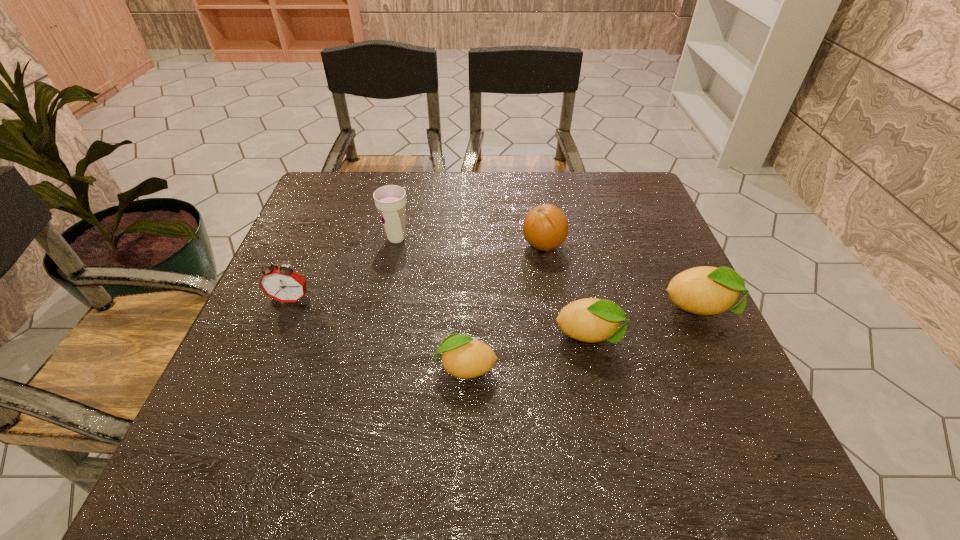
Image resolution: width=960 pixels, height=540 pixels. I want to click on the shortest object, so click(x=463, y=357).

You are a GUI agent. You are given a task and a screenshot of the screen. Output one action in this format:
    pyautogui.click(x=<x>, y=<y>)
    Task: Click on the shortest lemon
    
    Given the screenshot: What is the action you would take?
    pyautogui.click(x=463, y=357)

At what (x,y) coordinates should I click in order to perform the action: click on the second shortest lemon. Please return your answer as a coordinate pair (x, y). Looking at the image, I should click on (591, 320).

This screenshot has width=960, height=540. Find the location of `the rightmost object`. the rightmost object is located at coordinates (705, 290).

You are a GUI agent. You are given a task and a screenshot of the screen. Output one action in this format:
    pyautogui.click(x=<x>, y=<y>)
    Task: Click on the fifth object from right to left
    The width and height of the screenshot is (960, 540).
    Given the screenshot: What is the action you would take?
    pyautogui.click(x=390, y=200)

You are a GUI agent. You are given a task and a screenshot of the screen. Output one action in this format:
    pyautogui.click(x=<x>, y=<y>)
    Task: Click on the orange
    The width and height of the screenshot is (960, 540).
    Given the screenshot: What is the action you would take?
    point(545,227)

You are a GUI agent. You are given a task and a screenshot of the screen. Output one action in this format:
    pyautogui.click(x=<x>, y=<y>)
    Task: Click on the alarm clock
    The image size is (960, 540).
    Given the screenshot: What is the action you would take?
    pyautogui.click(x=283, y=284)

Find the location of a particular element. vacant position located 0.280m with leaves positioned above the shortest lemon is located at coordinates (288, 367).

At what (x,y) coordinates should I click in order to perform the action: click on vacant region located with leaves positioned above the shortest lemon. Please return your answer as a coordinate pair (x, y). This screenshot has width=960, height=540. Looking at the image, I should click on (303, 367).

Identify the location of free region located 0.280m with leaves positioned above the shortest lemon. Image resolution: width=960 pixels, height=540 pixels. (288, 367).